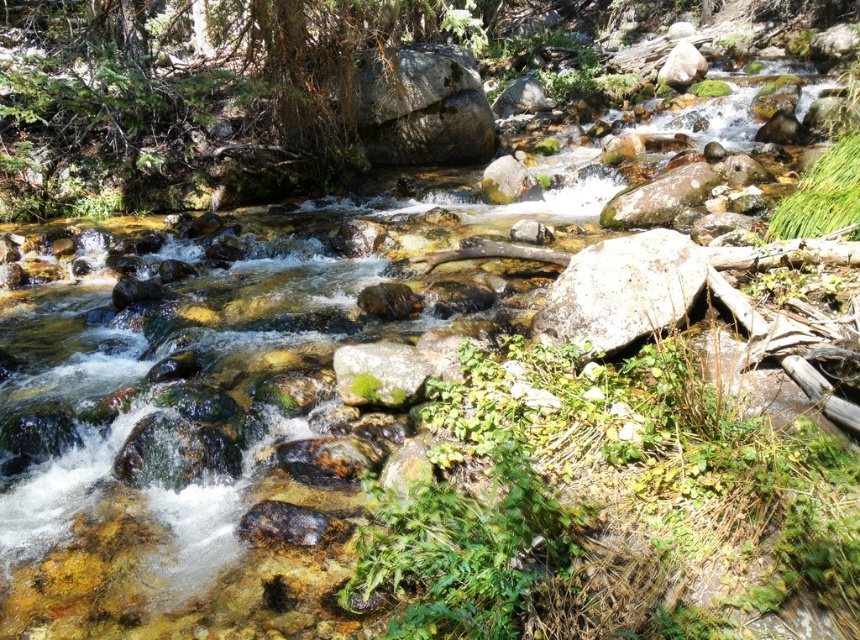
Question: Does white textured rock at center have a greater width compared to green mossy rock at center?

Choices:
 (A) no
 (B) yes

Answer: (B)

Question: Does white textured rock at center appear on the right side of green mossy rock at center?

Choices:
 (A) no
 (B) yes

Answer: (B)

Question: In this image, where is white textured rock at center located relative to green mossy rock at center?

Choices:
 (A) above
 (B) below

Answer: (A)

Question: Which of the following is the closest to the observer?

Choices:
 (A) white textured rock at center
 (B) green mossy rock at center

Answer: (A)

Question: Which point is closer to the camera taking this photo?

Choices:
 (A) (622, 317)
 (B) (409, 388)

Answer: (A)

Question: Which of the following is the farthest from the observer?

Choices:
 (A) green mossy rock at center
 (B) white textured rock at center

Answer: (A)